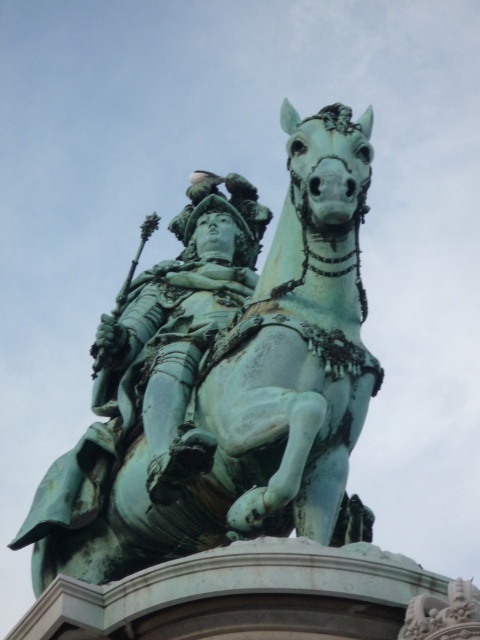
In the scene shown: You are standing at the origin point in the image. The green patinated bronze statue at center is located at coordinates point 0.594, 0.473. If you want to walk directly towards it, which direction should you move? Please provide your answer in terms of coordinate directions.

To reach the green patinated bronze statue at center located at coordinates point (227,380) from the origin, you should move in the positive x and positive y directions since both coordinates are greater than zero.